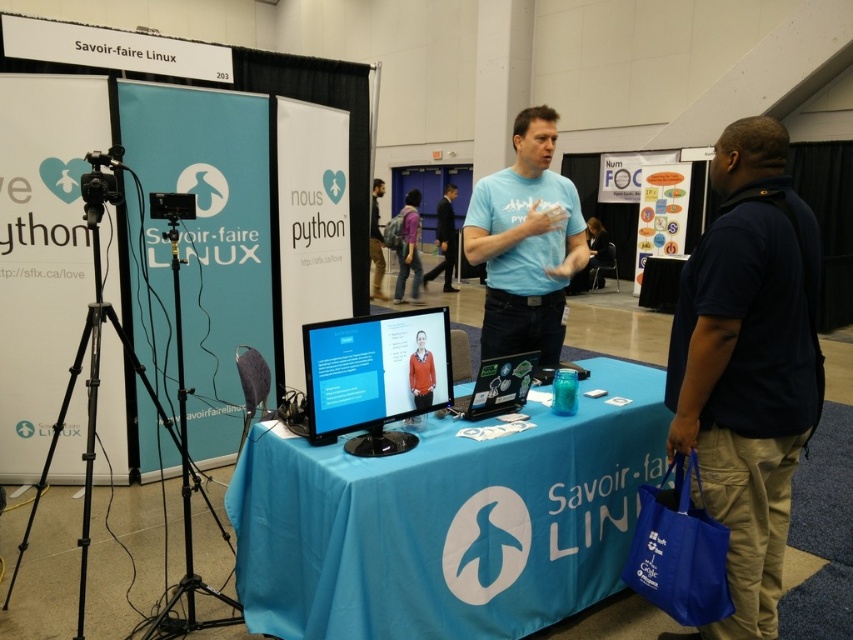
Question: Does light blue t-shirt at center have a greater width compared to orange sweater at center?

Choices:
 (A) yes
 (B) no

Answer: (A)

Question: Estimate the real-world distances between objects in this image. Which object is closer to the dark blue suit at center?

Choices:
 (A) blue t-shirt at center
 (B) purple fabric backpack at center
 (C) matte black laptop at center

Answer: (B)

Question: Is light blue t-shirt at center positioned in front of dark blue suit at center?

Choices:
 (A) yes
 (B) no

Answer: (A)

Question: Among these points, which one is farthest from the camera?

Choices:
 (A) (421, 339)
 (B) (538, 227)
 (C) (437, 209)
 (D) (409, 228)

Answer: (C)

Question: Is blue fabric table at center above light blue shirt at center?

Choices:
 (A) no
 (B) yes

Answer: (A)

Question: Which object is positioned farthest from the matte black monitor at center?

Choices:
 (A) blue fabric table at center
 (B) dark blue suit at center
 (C) matte black laptop at center
 (D) orange sweater at center

Answer: (B)